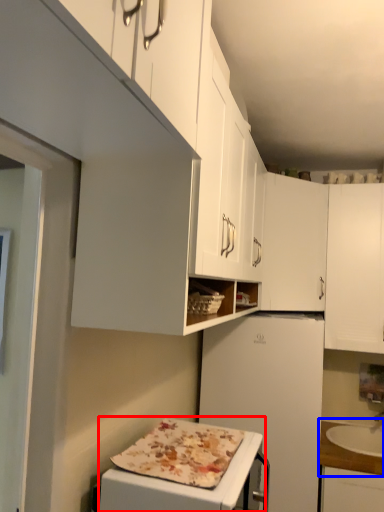
Question: Which of the following is the farthest to the observer, appliance (highlighted by a red box) or countertop (highlighted by a blue box)?

Choices:
 (A) appliance
 (B) countertop

Answer: (B)